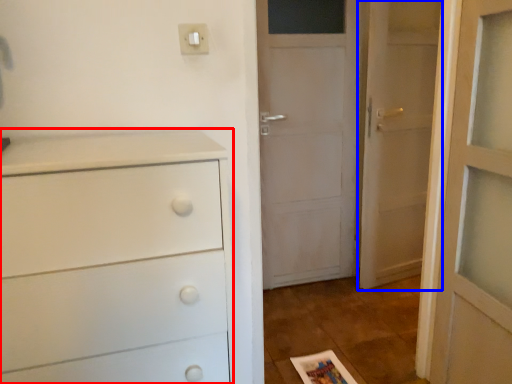
Question: Which object is further to the camera taking this photo, chest of drawers (highlighted by a red box) or door (highlighted by a blue box)?

Choices:
 (A) chest of drawers
 (B) door

Answer: (B)